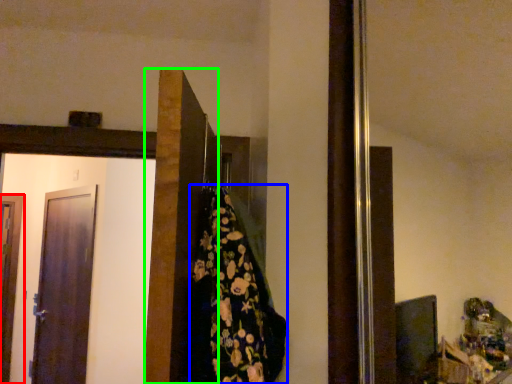
Question: Estimate the real-world distances between objects in this image. Which object is farther from door (highlighted by a red box), blanket (highlighted by a blue box) or door (highlighted by a green box)?

Choices:
 (A) blanket
 (B) door

Answer: (A)